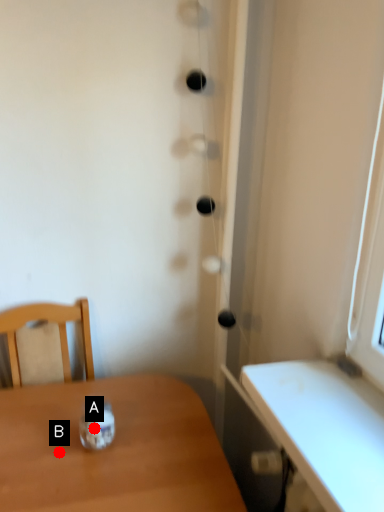
Question: Two points are circled on the image, labeled by A and B beside each circle. Which point is farther from the camera taking this photo?

Choices:
 (A) A is further
 (B) B is further

Answer: (A)